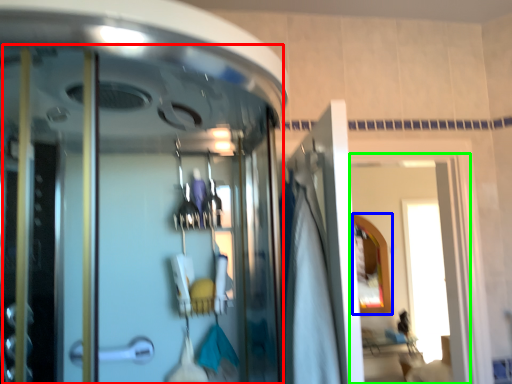
Question: Based on their relative distances, which object is farther from screen door (highlighted by a red box)? Choose from mirror (highlighted by a blue box) and window (highlighted by a green box).

Choices:
 (A) mirror
 (B) window

Answer: (B)